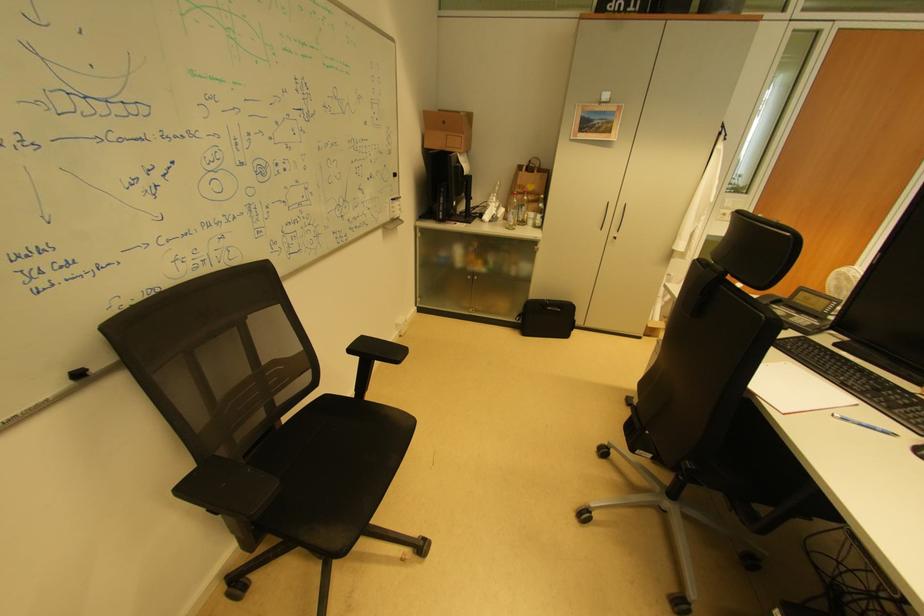
Find where to writ the blue ballpoint pen. Please return your answer as a coordinate pair (x, y).

(864, 424)